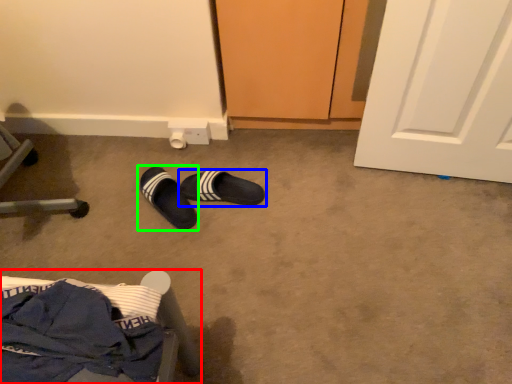
Question: Which is nearer to the furniture (highlighted by a red box)? footwear (highlighted by a blue box) or footwear (highlighted by a green box).

Choices:
 (A) footwear
 (B) footwear

Answer: (B)